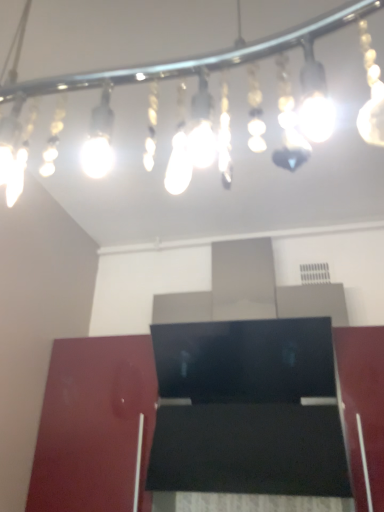
Question: Would you say glossy wood cabinet at lower left is inside or outside translucent glass light fixture at upper center?

Choices:
 (A) outside
 (B) inside

Answer: (A)

Question: Considering the positions of glossy wood cabinet at lower left and translucent glass light fixture at upper center in the image, is glossy wood cabinet at lower left wider or thinner than translucent glass light fixture at upper center?

Choices:
 (A) wide
 (B) thin

Answer: (B)

Question: Based on their sizes in the image, would you say glossy wood cabinet at lower left is bigger or smaller than translucent glass light fixture at upper center?

Choices:
 (A) big
 (B) small

Answer: (A)

Question: Considering the positions of translucent glass light fixture at upper center and glossy wood cabinet at lower left in the image, is translucent glass light fixture at upper center wider or thinner than glossy wood cabinet at lower left?

Choices:
 (A) thin
 (B) wide

Answer: (B)

Question: Is translucent glass light fixture at upper center situated inside glossy wood cabinet at lower left or outside?

Choices:
 (A) inside
 (B) outside

Answer: (B)

Question: Visually, is translucent glass light fixture at upper center positioned to the left or to the right of glossy wood cabinet at lower left?

Choices:
 (A) left
 (B) right

Answer: (B)

Question: From a real-world perspective, is translucent glass light fixture at upper center physically located above or below glossy wood cabinet at lower left?

Choices:
 (A) above
 (B) below

Answer: (A)